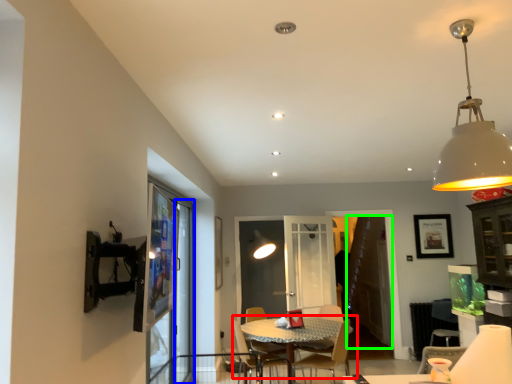
Question: Which object is the closest to the table (highlighted by a red box)? Choose among these: screen door (highlighted by a blue box) or screen door (highlighted by a green box).

Choices:
 (A) screen door
 (B) screen door

Answer: (A)